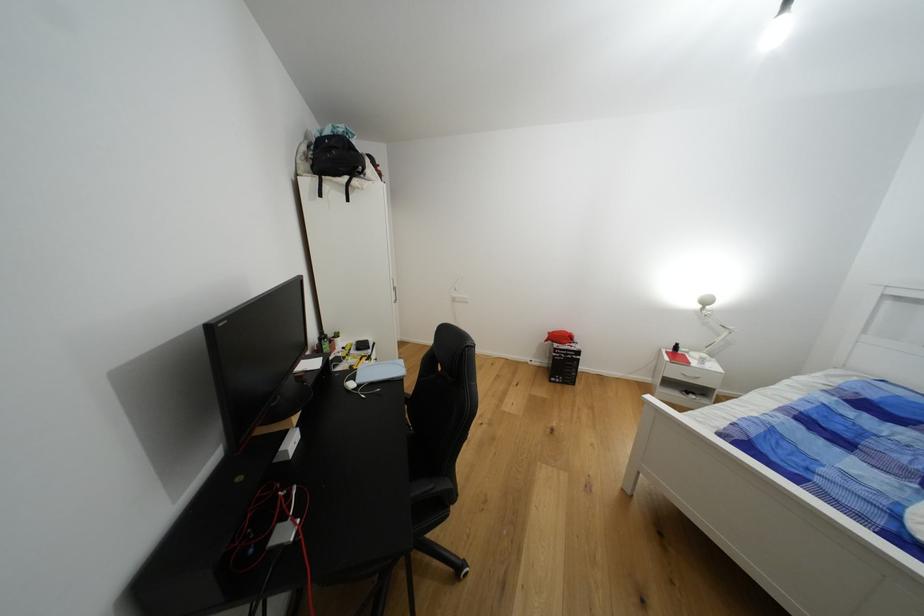
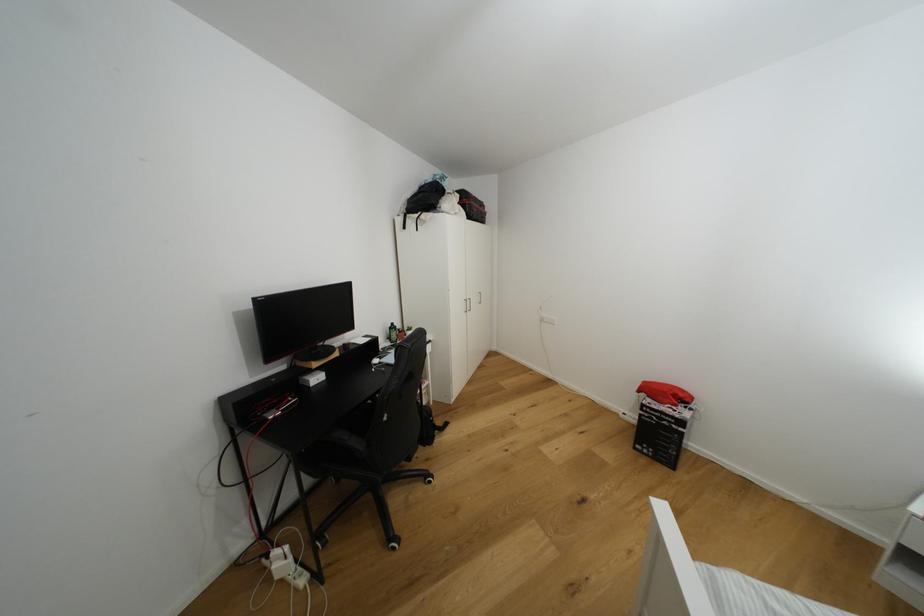
Question: The camera is either moving clockwise (left) or counter-clockwise (right) around the object. The first image is from the beginning of the video and the second image is from the end. Is the camera moving left or right when shooting the video?

Choices:
 (A) Left
 (B) Right

Answer: (B)